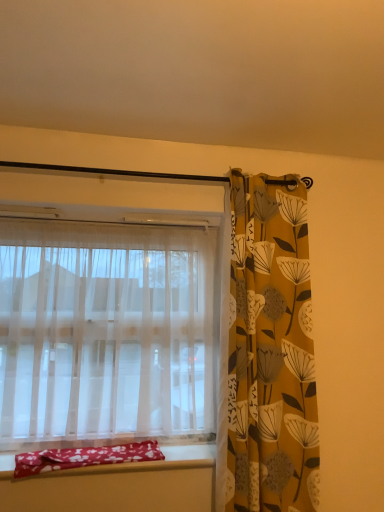
Locate an element on the screen. This screenshot has width=384, height=512. red fabric pillow at lower left is located at coordinates (85, 457).

Considering the sizes of red fabric pillow at lower left and yellow floral fabric curtain at right, which is the first curtain in right-to-left order, in the image, is red fabric pillow at lower left wider or thinner than yellow floral fabric curtain at right, which is the first curtain in right-to-left order,?

red fabric pillow at lower left is wider than yellow floral fabric curtain at right, which is the first curtain in right-to-left order.

Image resolution: width=384 pixels, height=512 pixels. I want to click on curtain lying in front of the red fabric pillow at lower left, so click(269, 353).

Which is in front, point (23, 473) or point (291, 315)?

The point (23, 473) is closer to the camera.

Can you tell me how much yellow floral fabric curtain at right, which is the first curtain in right-to-left order, and sheer white curtain at left, which appears as the first curtain when viewed from the left, differ in facing direction?

The angular difference between yellow floral fabric curtain at right, which is the first curtain in right-to-left order, and sheer white curtain at left, which appears as the first curtain when viewed from the left, is 0.00123 degrees.

Is yellow floral fabric curtain at right, the 2th curtain viewed from the left, touching sheer white curtain at left, arranged as the second curtain when viewed from the right?

No, yellow floral fabric curtain at right, the 2th curtain viewed from the left, is not beside sheer white curtain at left, arranged as the second curtain when viewed from the right.

How much distance is there between yellow floral fabric curtain at right, the 2th curtain viewed from the left, and sheer white curtain at left, arranged as the second curtain when viewed from the right?

yellow floral fabric curtain at right, the 2th curtain viewed from the left, is 18.06 inches away from sheer white curtain at left, arranged as the second curtain when viewed from the right.

From a real-world perspective, which object stands above the other?

In real-world perspective, sheer white curtain at left, arranged as the second curtain when viewed from the right, is above.

Based on the photo, is sheer white curtain at left, arranged as the second curtain when viewed from the right, looking in the opposite direction of yellow floral fabric curtain at right, the 2th curtain viewed from the left?

No, sheer white curtain at left, arranged as the second curtain when viewed from the right, is not facing the opposite direction of yellow floral fabric curtain at right, the 2th curtain viewed from the left.

From a real-world perspective, is sheer white curtain at left, which appears as the first curtain when viewed from the left, above or below yellow floral fabric curtain at right, which is the first curtain in right-to-left order?

sheer white curtain at left, which appears as the first curtain when viewed from the left, is above yellow floral fabric curtain at right, which is the first curtain in right-to-left order.

In the scene shown: Is sheer white curtain at left, which appears as the first curtain when viewed from the left, to the left of yellow floral fabric curtain at right, the 2th curtain viewed from the left, from the viewer's perspective?

Yes.

From the image's perspective, is sheer white curtain at left, which appears as the first curtain when viewed from the left, located above yellow floral fabric curtain at right, which is the first curtain in right-to-left order?

No, from the image's perspective, sheer white curtain at left, which appears as the first curtain when viewed from the left, is not over yellow floral fabric curtain at right, which is the first curtain in right-to-left order.

Are sheer white curtain at left, which appears as the first curtain when viewed from the left, and red fabric pillow at lower left far apart?

sheer white curtain at left, which appears as the first curtain when viewed from the left, is actually quite close to red fabric pillow at lower left.

Considering the sizes of objects sheer white curtain at left, arranged as the second curtain when viewed from the right, and red fabric pillow at lower left in the image provided, who is bigger, sheer white curtain at left, arranged as the second curtain when viewed from the right, or red fabric pillow at lower left?

sheer white curtain at left, arranged as the second curtain when viewed from the right, is bigger.

From the image's perspective, would you say sheer white curtain at left, arranged as the second curtain when viewed from the right, is positioned over red fabric pillow at lower left?

Yes.

In terms of height, does sheer white curtain at left, which appears as the first curtain when viewed from the left, look taller or shorter compared to red fabric pillow at lower left?

sheer white curtain at left, which appears as the first curtain when viewed from the left, is taller than red fabric pillow at lower left.

Between red fabric pillow at lower left and sheer white curtain at left, arranged as the second curtain when viewed from the right, which one has larger width?

Wider between the two is red fabric pillow at lower left.

From the image's perspective, does red fabric pillow at lower left appear lower than sheer white curtain at left, which appears as the first curtain when viewed from the left?

Yes, from the image's perspective, red fabric pillow at lower left is beneath sheer white curtain at left, which appears as the first curtain when viewed from the left.

From a real-world perspective, which is physically below, red fabric pillow at lower left or sheer white curtain at left, which appears as the first curtain when viewed from the left?

red fabric pillow at lower left is physically lower.

Considering their positions, is red fabric pillow at lower left located in front of or behind sheer white curtain at left, which appears as the first curtain when viewed from the left?

In the image, red fabric pillow at lower left appears in front of sheer white curtain at left, which appears as the first curtain when viewed from the left.

Is yellow floral fabric curtain at right, which is the first curtain in right-to-left order, next to red fabric pillow at lower left?

yellow floral fabric curtain at right, which is the first curtain in right-to-left order, is not next to red fabric pillow at lower left, and they're not touching.

Looking at their sizes, would you say yellow floral fabric curtain at right, the 2th curtain viewed from the left, is wider or thinner than red fabric pillow at lower left?

yellow floral fabric curtain at right, the 2th curtain viewed from the left, is thinner than red fabric pillow at lower left.

Based on the photo, which is less distant, (x=260, y=442) or (x=68, y=460)?

The point (x=68, y=460) is in front.

You are a GUI agent. You are given a task and a screenshot of the screen. Output one action in this format:
    pyautogui.click(x=<x>, y=<y>)
    Task: Click on the curtain in front of the red fabric pillow at lower left
    
    Given the screenshot: What is the action you would take?
    tap(269, 353)

Locate an element on the screen. curtain on the right side of sheer white curtain at left, which appears as the first curtain when viewed from the left is located at coordinates (269, 353).

When comparing their distances from sheer white curtain at left, arranged as the second curtain when viewed from the right, does yellow floral fabric curtain at right, the 2th curtain viewed from the left, or red fabric pillow at lower left seem closer?

The object closer to sheer white curtain at left, arranged as the second curtain when viewed from the right, is red fabric pillow at lower left.

In the scene shown: When comparing their distances from red fabric pillow at lower left, does sheer white curtain at left, arranged as the second curtain when viewed from the right, or yellow floral fabric curtain at right, which is the first curtain in right-to-left order, seem further?

yellow floral fabric curtain at right, which is the first curtain in right-to-left order, is positioned further to the anchor red fabric pillow at lower left.

From the image, which object appears to be nearer to yellow floral fabric curtain at right, which is the first curtain in right-to-left order, sheer white curtain at left, which appears as the first curtain when viewed from the left, or red fabric pillow at lower left?

Among the two, sheer white curtain at left, which appears as the first curtain when viewed from the left, is located nearer to yellow floral fabric curtain at right, which is the first curtain in right-to-left order.

Estimate the real-world distances between objects in this image. Which object is further from sheer white curtain at left, arranged as the second curtain when viewed from the right, red fabric pillow at lower left or yellow floral fabric curtain at right, which is the first curtain in right-to-left order?

yellow floral fabric curtain at right, which is the first curtain in right-to-left order, lies further to sheer white curtain at left, arranged as the second curtain when viewed from the right, than the other object.

When comparing their distances from yellow floral fabric curtain at right, which is the first curtain in right-to-left order, does red fabric pillow at lower left or sheer white curtain at left, which appears as the first curtain when viewed from the left, seem closer?

sheer white curtain at left, which appears as the first curtain when viewed from the left.

When comparing their distances from red fabric pillow at lower left, does yellow floral fabric curtain at right, the 2th curtain viewed from the left, or sheer white curtain at left, which appears as the first curtain when viewed from the left, seem further?

yellow floral fabric curtain at right, the 2th curtain viewed from the left, is further to red fabric pillow at lower left.

Where is `curtain between red fabric pillow at lower left and yellow floral fabric curtain at right, the 2th curtain viewed from the left, from left to right`? The width and height of the screenshot is (384, 512). curtain between red fabric pillow at lower left and yellow floral fabric curtain at right, the 2th curtain viewed from the left, from left to right is located at coordinates (104, 331).